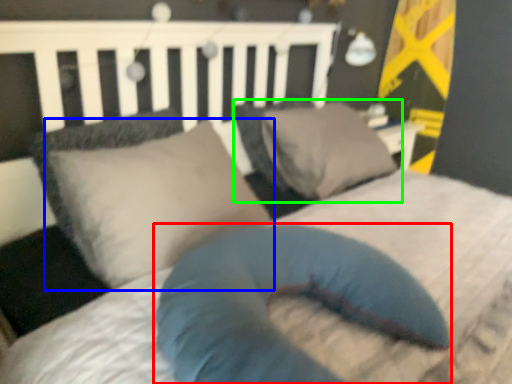
Question: Estimate the real-world distances between objects in this image. Which object is farther from pillow (highlighted by a red box), pillow (highlighted by a blue box) or pillow (highlighted by a green box)?

Choices:
 (A) pillow
 (B) pillow

Answer: (B)